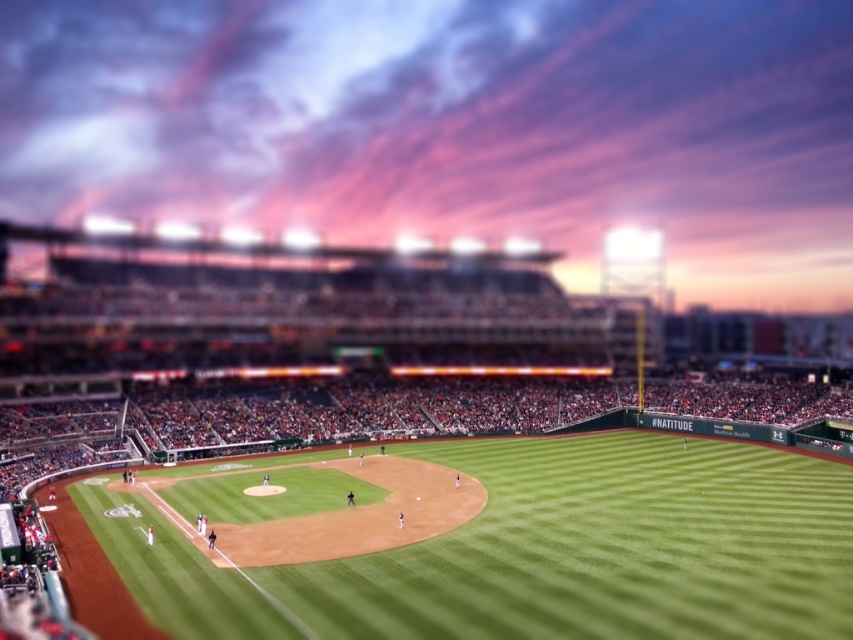
Question: Among these objects, which one is farthest from the camera?

Choices:
 (A) green grass field at center
 (B) green grass baseball stadium at center

Answer: (B)

Question: Which point is farther from the camera taking this photo?

Choices:
 (A) (743, 618)
 (B) (560, 448)

Answer: (B)

Question: Does green grass baseball stadium at center appear over green grass field at center?

Choices:
 (A) yes
 (B) no

Answer: (A)

Question: Is green grass baseball stadium at center bigger than green grass field at center?

Choices:
 (A) no
 (B) yes

Answer: (B)

Question: Is green grass baseball stadium at center to the right of green grass field at center from the viewer's perspective?

Choices:
 (A) no
 (B) yes

Answer: (A)